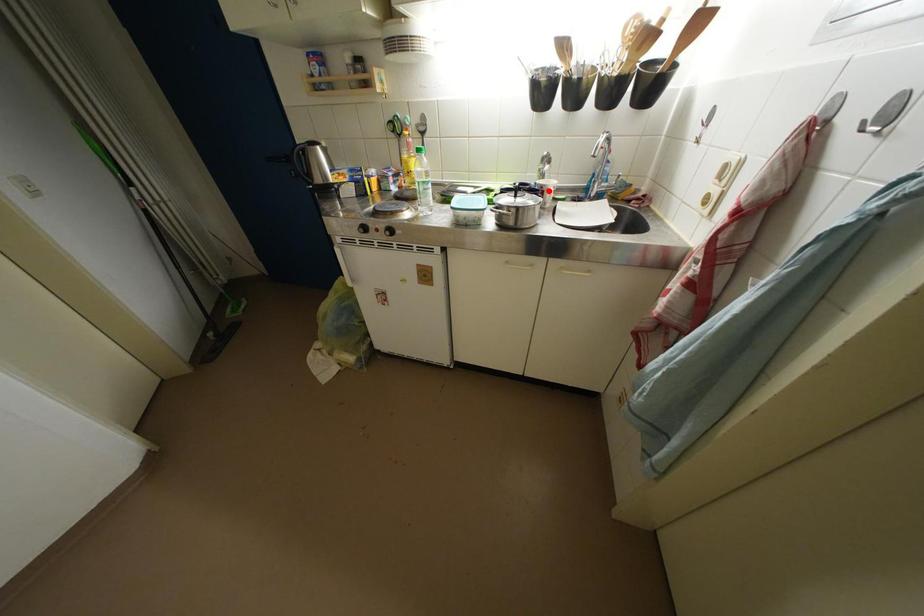
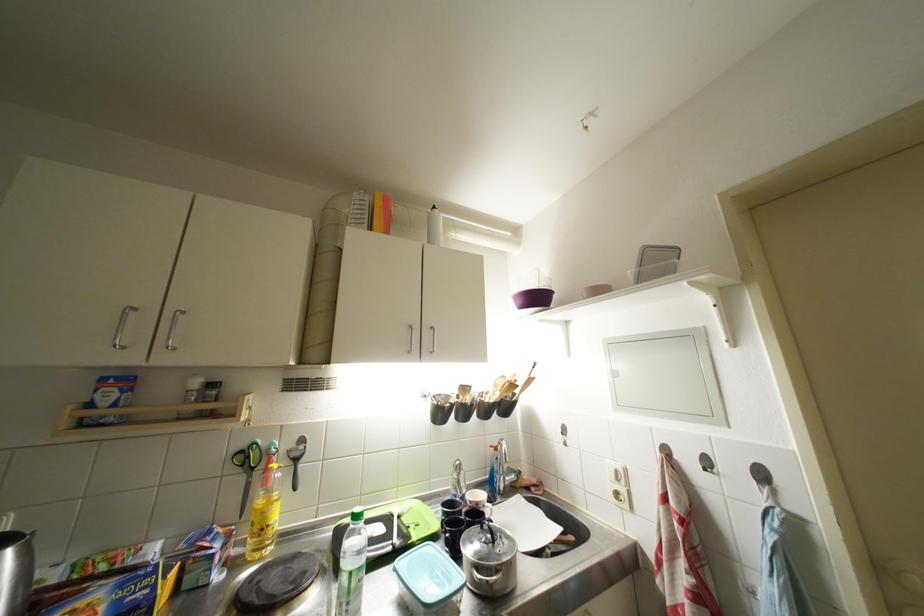
The point at the highlighted location is marked in the first image. Where is the corresponding point in the second image?

(483, 508)